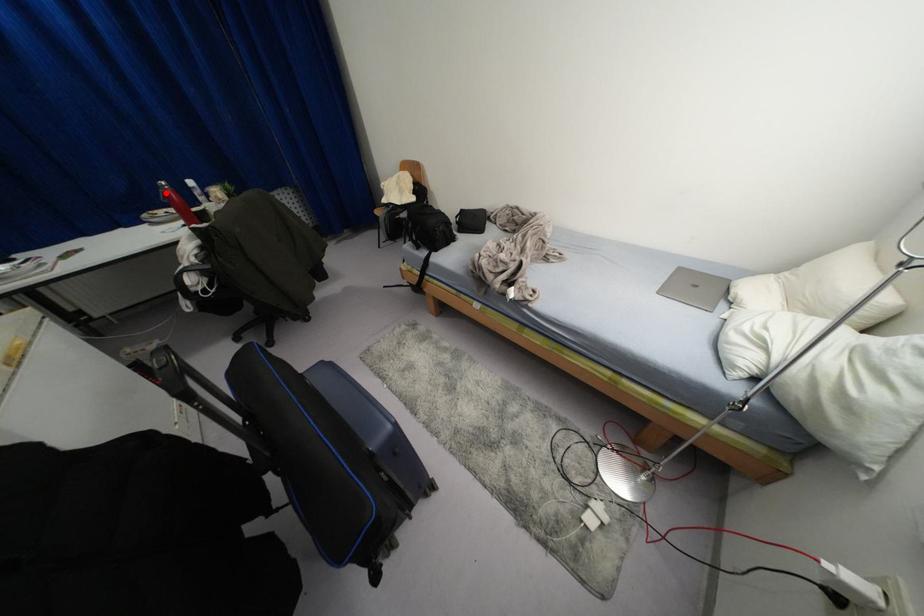
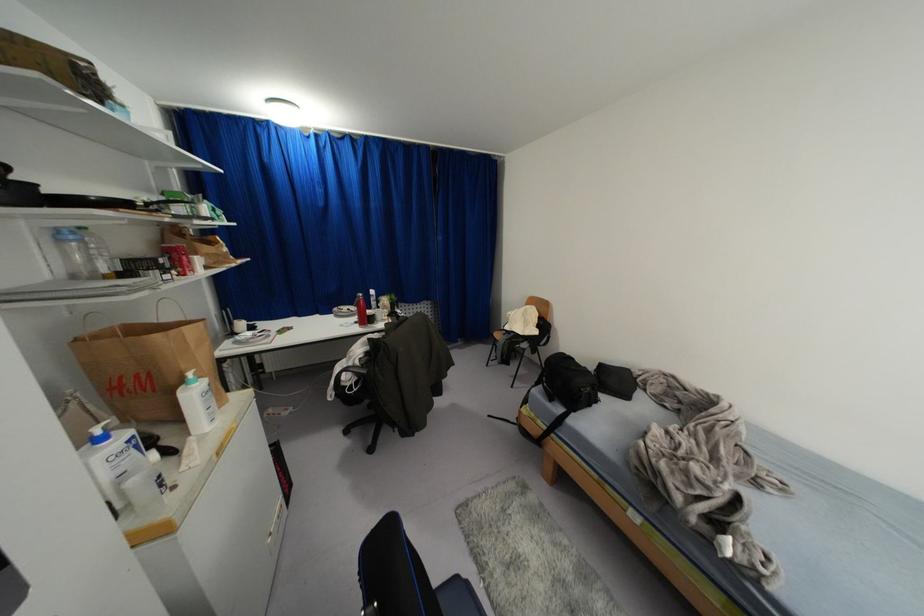
Find the pixel in the second image that matches the highlighted location in the first image.

(359, 301)